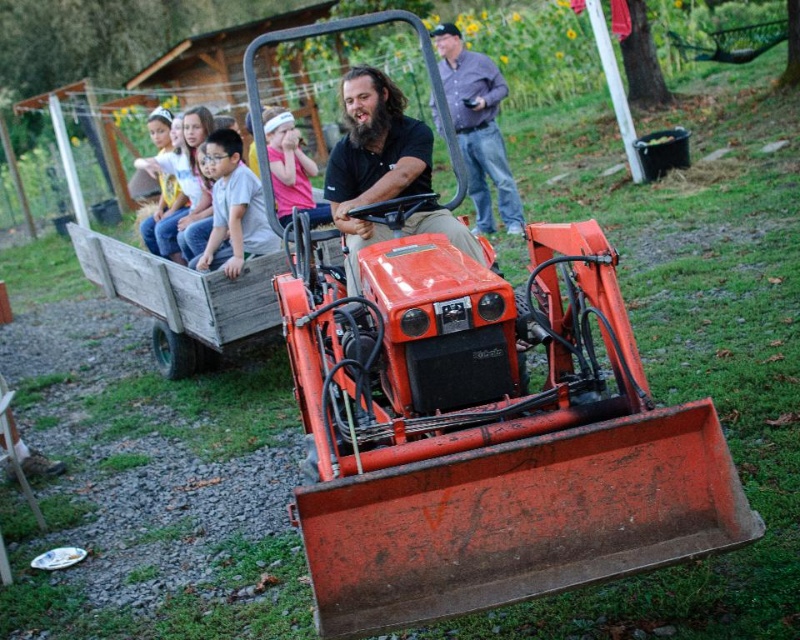
You are standing in front of the tractor and want to place a small flag at each of the two points, point (508, 208) and point (246, 240). Which point is closer to you so that you can reach it without moving your position?

Point (246, 240) is closer to you because it is less further to the viewer than point (508, 208).

You are a photographer taking a picture of the matte black tractor at center and the pink fabric headband at upper center. Which object should you focus on first to ensure both are in focus?

You should focus on the matte black tractor at center first because it is closer to the viewer than the pink fabric headband at upper center, so adjusting focus from near to far will help both be in focus.

You are a photographer trying to capture a clear photo of both the matte black tractor at center and the light gray cotton shirt at center. Since you want both subjects to be fully visible, which object should you focus on first to ensure depth of field?

The matte black tractor at center is much taller than the light gray cotton shirt at center, so you should focus on the tractor first to ensure both are in focus.